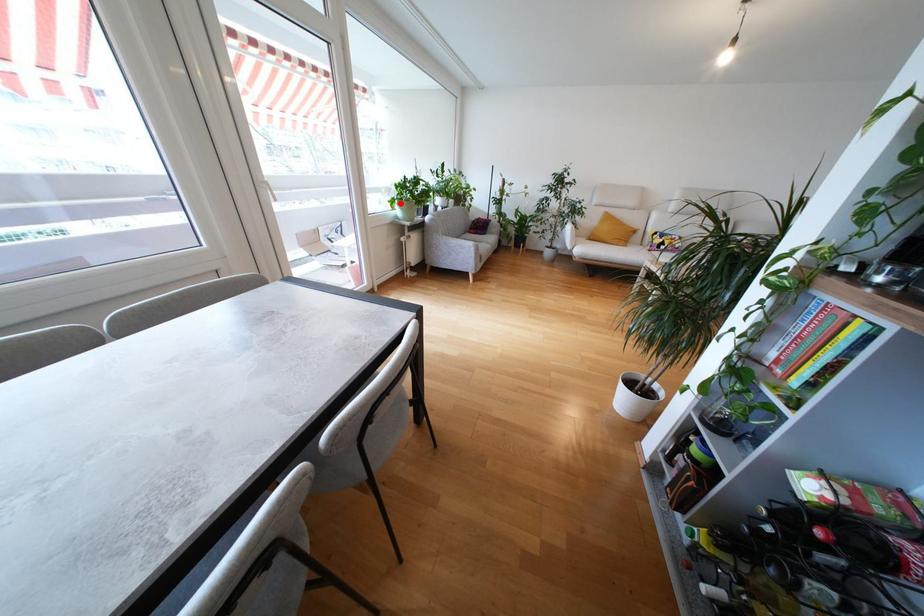
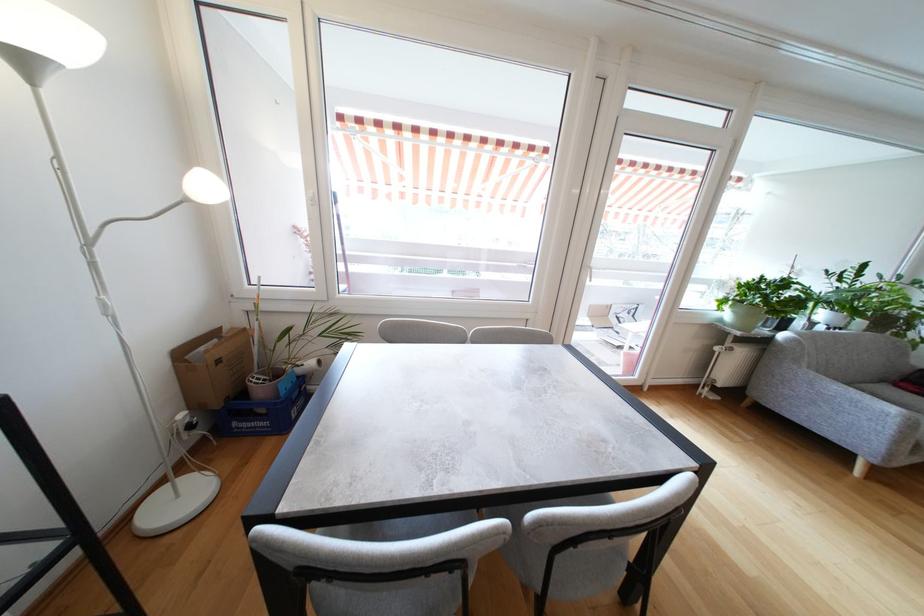
In the second image, find the point that corresponds to the highlighted location in the first image.

(735, 305)